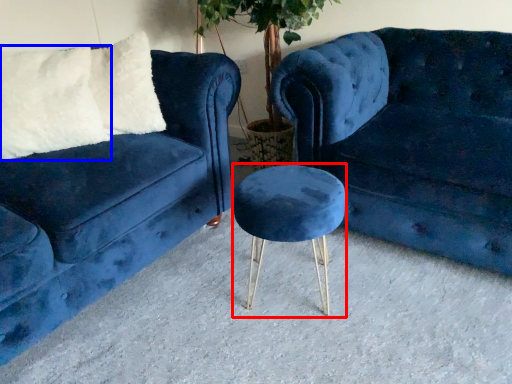
Question: Which point is closer to the camera, bar stool (highlighted by a red box) or pillow (highlighted by a blue box)?

Choices:
 (A) bar stool
 (B) pillow

Answer: (A)